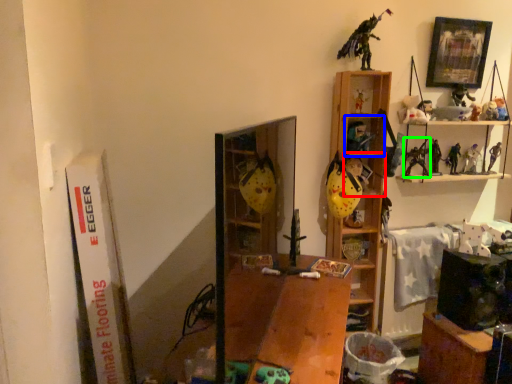
Question: Estimate the real-world distances between objects in this image. Which object is closer to cabinet (highlighted by a red box), cabinet (highlighted by a blue box) or toy (highlighted by a green box)?

Choices:
 (A) cabinet
 (B) toy

Answer: (A)